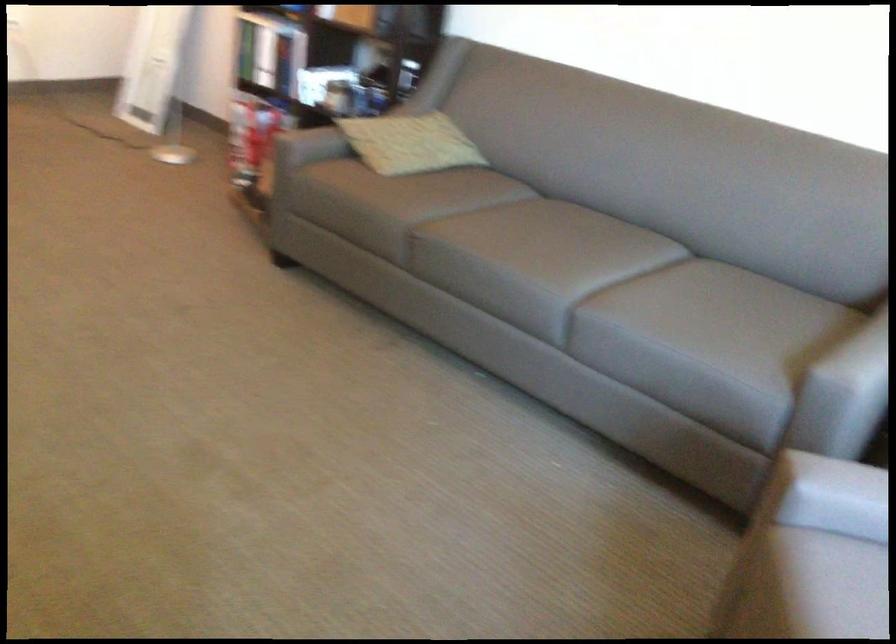
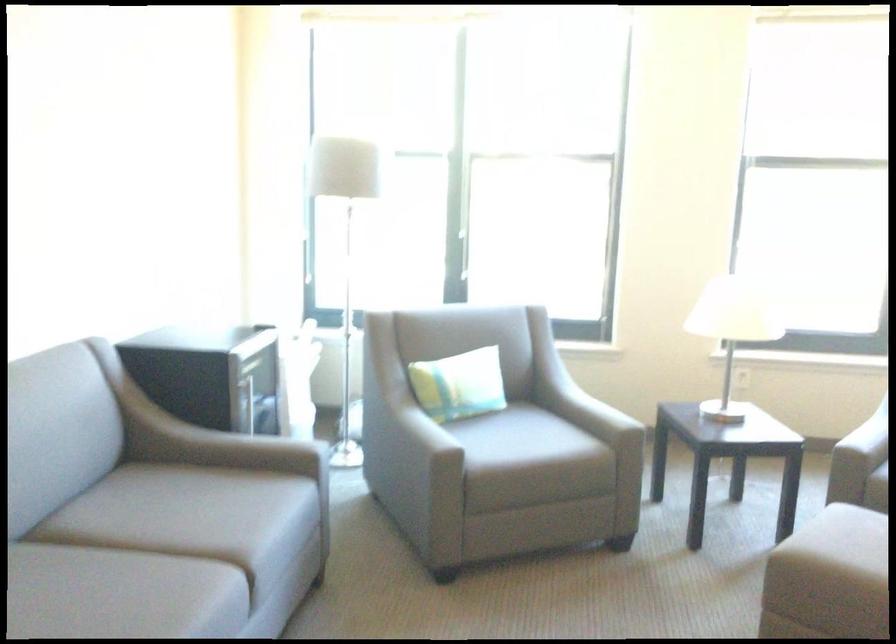
Where in the second image is the point corresponding to point (550, 251) from the first image?

(119, 594)